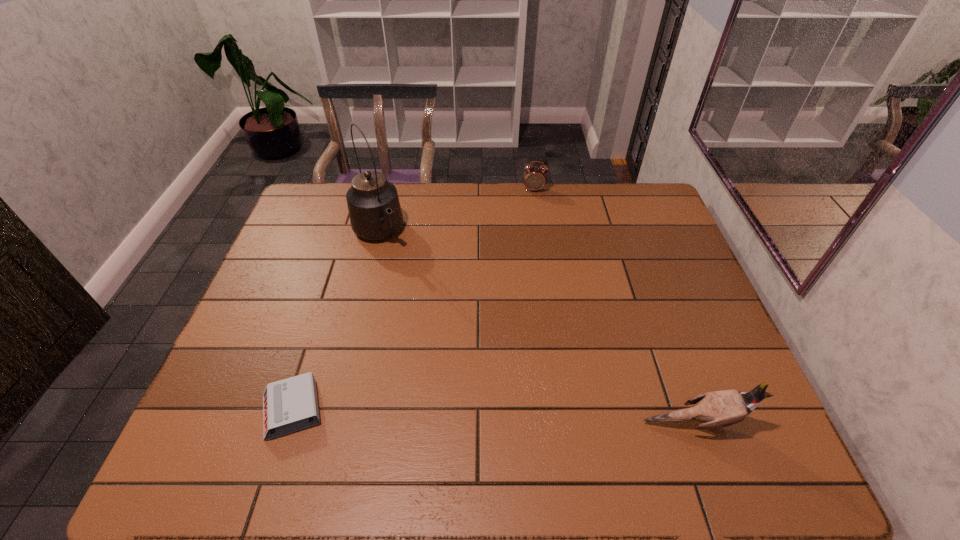
Locate an element on the screen. The image size is (960, 540). object positioned at the right edge is located at coordinates (717, 409).

This screenshot has height=540, width=960. In order to click on object that is at the near left corner in this screenshot , I will do `click(289, 405)`.

Where is `object that is at the near right corner`? object that is at the near right corner is located at coordinates (717, 409).

Locate an element on the screen. The height and width of the screenshot is (540, 960). free location at the far edge of the desktop is located at coordinates (568, 222).

Image resolution: width=960 pixels, height=540 pixels. In the image, there is a desktop. Find the location of `vacant region at the near edge`. vacant region at the near edge is located at coordinates (583, 388).

Locate an element on the screen. vacant space at the left edge of the desktop is located at coordinates (332, 252).

Locate an element on the screen. The image size is (960, 540). vacant space at the right edge is located at coordinates (632, 243).

Locate an element on the screen. vacant space at the near left corner of the desktop is located at coordinates (224, 409).

The width and height of the screenshot is (960, 540). In the image, there is a desktop. In order to click on blank space at the far right corner in this screenshot , I will do `click(622, 204)`.

You are a GUI agent. You are given a task and a screenshot of the screen. Output one action in this format:
    pyautogui.click(x=<x>, y=<y>)
    Task: Click on the free space between the farthest object and the tallest object
    This screenshot has height=540, width=960.
    Given the screenshot: What is the action you would take?
    pyautogui.click(x=456, y=211)